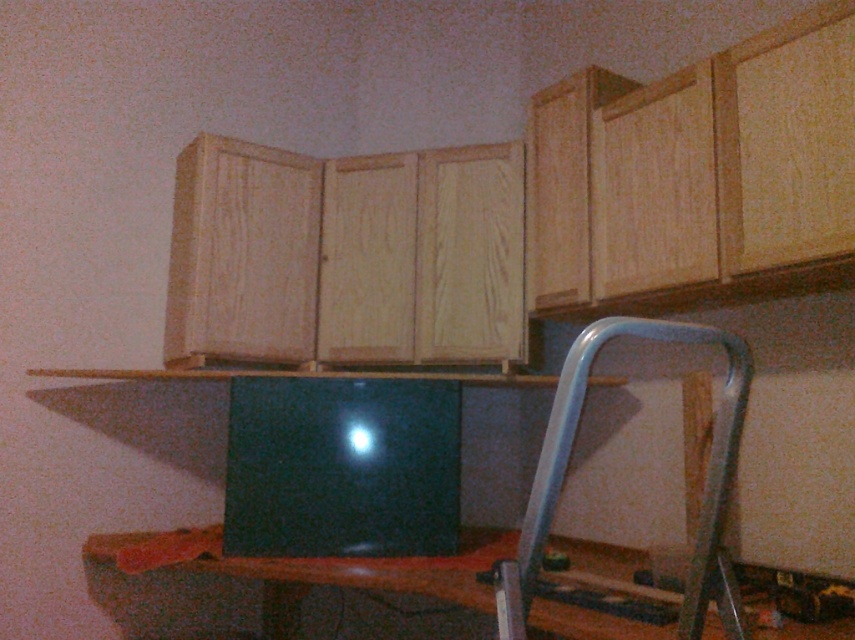
Question: Does wooden table at center appear on the right side of metallic silver chair at lower right?

Choices:
 (A) yes
 (B) no

Answer: (B)

Question: Which point is farther from the camera taking this photo?

Choices:
 (A) (522, 618)
 (B) (258, 609)
 (C) (375, 429)

Answer: (B)

Question: Among these points, which one is nearest to the camera?

Choices:
 (A) (116, 538)
 (B) (734, 422)
 (C) (231, 413)

Answer: (B)

Question: Which is nearer to the metallic silver chair at lower right?

Choices:
 (A) black glossy laptop at center
 (B) wooden table at center

Answer: (B)

Question: Is black glossy laptop at center to the right of metallic silver chair at lower right from the viewer's perspective?

Choices:
 (A) yes
 (B) no

Answer: (B)

Question: Is black glossy laptop at center closer to camera compared to metallic silver chair at lower right?

Choices:
 (A) yes
 (B) no

Answer: (B)